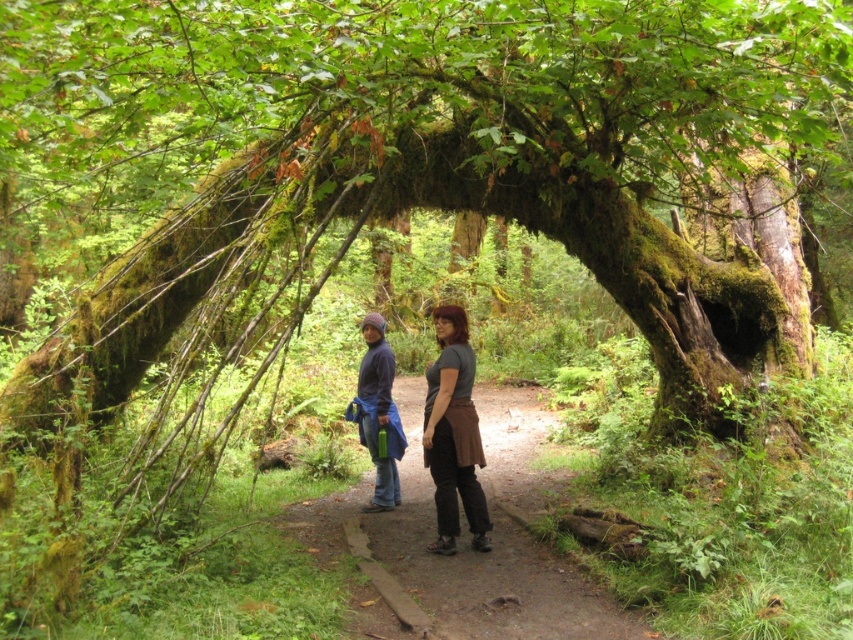
Question: Among these objects, which one is nearest to the camera?

Choices:
 (A) brown leather skirt at center
 (B) brushed metal jacket at center
 (C) dark gray fabric at center

Answer: (C)

Question: Which point is closer to the camera taking this photo?

Choices:
 (A) (405, 464)
 (B) (386, 390)

Answer: (B)

Question: Considering the real-world distances, which object is farthest from the brown leather skirt at center?

Choices:
 (A) brushed metal jacket at center
 (B) dark gray fabric at center
 (C) dirt path at center

Answer: (C)

Question: Does dirt path at center have a greater width compared to dark gray fabric at center?

Choices:
 (A) no
 (B) yes

Answer: (B)

Question: Is brown leather skirt at center to the left of brushed metal jacket at center from the viewer's perspective?

Choices:
 (A) yes
 (B) no

Answer: (B)

Question: Where is dirt path at center located in relation to dark gray fabric at center in the image?

Choices:
 (A) below
 (B) above

Answer: (A)